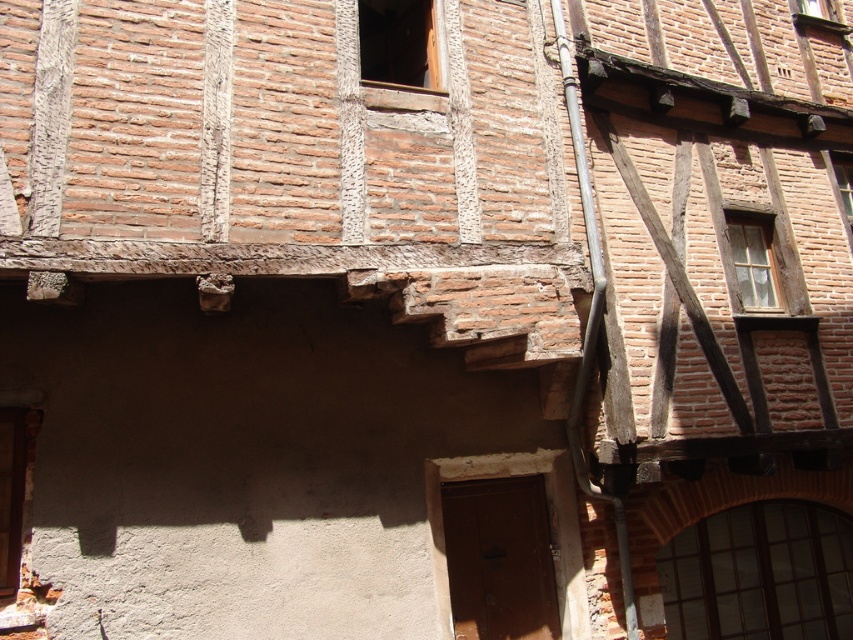
At what (x,y) coordinates should I click in order to perform the action: click on dark glass window at lower right. Please return your answer as a coordinate pair (x, y). Looking at the image, I should click on (759, 573).

Can you confirm if dark glass window at lower right is smaller than wooden frame at upper center?

No.

Is point (816, 593) more distant than point (378, 20)?

Yes, it is behind point (378, 20).

Locate an element on the screen. The width and height of the screenshot is (853, 640). dark glass window at lower right is located at coordinates (759, 573).

How distant is clear glass window at upper right from clear glass window at upper center?

clear glass window at upper right and clear glass window at upper center are 6.63 feet apart from each other.

Between point (849, 214) and point (833, 6), which one is positioned behind?

Point (833, 6)

Who is more distant from viewer, (x=845, y=154) or (x=816, y=0)?

Point (x=816, y=0)

This screenshot has width=853, height=640. I want to click on clear glass window at upper right, so click(x=843, y=179).

You are a GUI agent. You are given a task and a screenshot of the screen. Output one action in this format:
    pyautogui.click(x=<x>, y=<y>)
    Task: Click on the wooden frame at upper center
    
    Given the screenshot: What is the action you would take?
    pyautogui.click(x=397, y=42)

The height and width of the screenshot is (640, 853). Describe the element at coordinates (397, 42) in the screenshot. I see `wooden frame at upper center` at that location.

I want to click on wooden frame at upper center, so click(x=397, y=42).